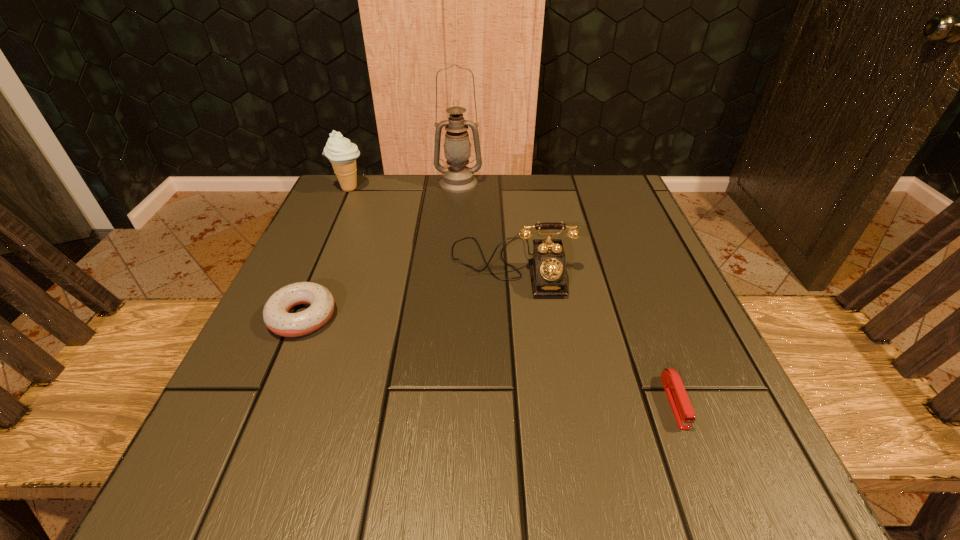
The image size is (960, 540). Find the location of `empty space between the doughnut and the shortest object`. empty space between the doughnut and the shortest object is located at coordinates (489, 359).

Locate an element on the screen. free spot between the third tallest object and the oil lamp is located at coordinates (485, 225).

Point out which object is positioned as the third nearest to the shortest object. Please provide its 2D coordinates. Your answer should be formatted as a tuple, i.e. [(x, y)], where the tuple contains the x and y coordinates of a point satisfying the conditions above.

[(458, 178)]

At what (x,y) coordinates should I click in order to perform the action: click on object that is the second nearest to the stapler. Please return your answer as a coordinate pair (x, y). The width and height of the screenshot is (960, 540). Looking at the image, I should click on (275, 313).